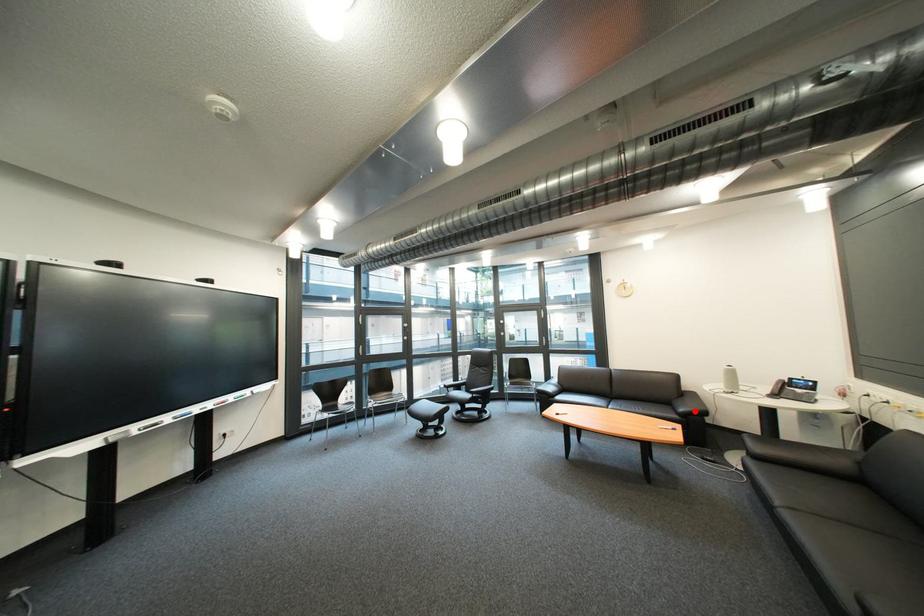
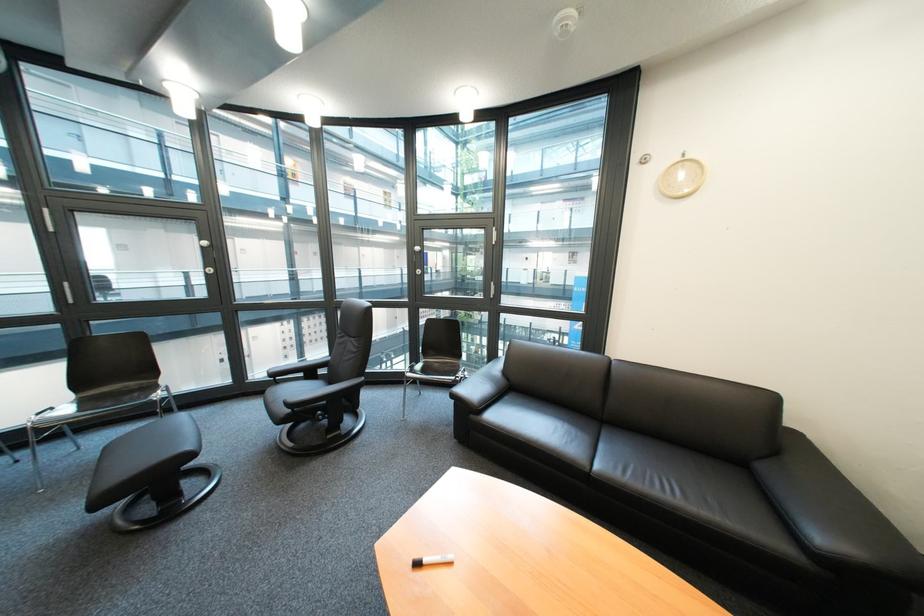
Where in the second image is the point corresponding to the highlighted location from the first image?

(833, 540)